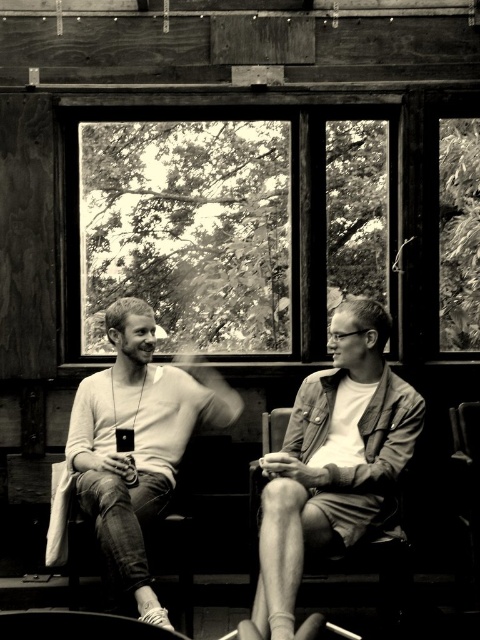
You are an interior designer assessing the space in the image. You need to determine if the wooden frame window at upper center can be replaced with a larger one that matches the size of the matte brown leather jacket at center. Is the current window at upper center smaller than the jacket?

The wooden frame window at upper center has a smaller size compared to the matte brown leather jacket at center, so the current window is indeed smaller than the jacket. Therefore, replacing it with a larger one to match the jacket size would require structural adjustments to the wooden walls.

You are an interior designer observing the scene. You notice the matte brown leather jacket at center and the smooth white sweater at center. Which item is positioned in front of the other?

The matte brown leather jacket at center is positioned in front of the smooth white sweater at center because it is closer to the viewer.